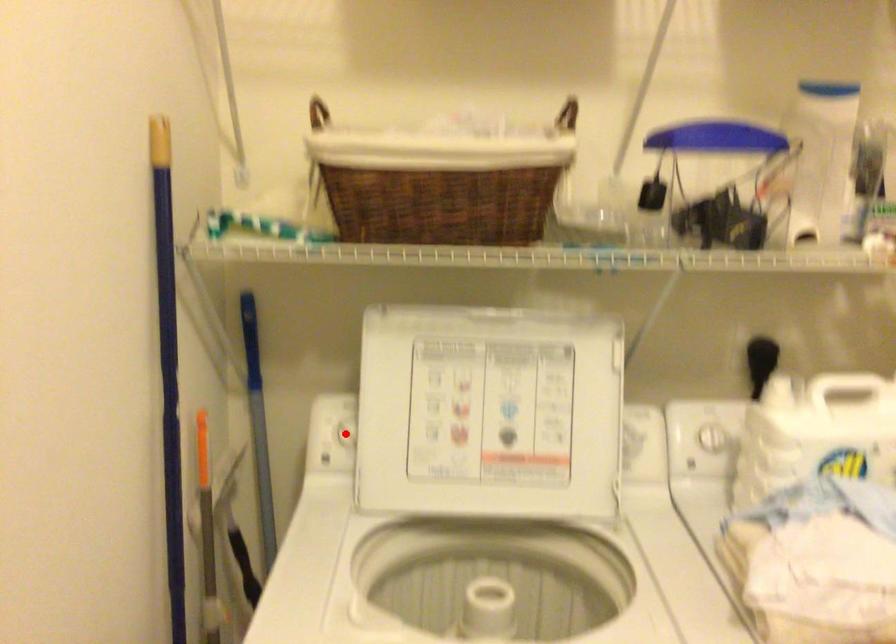
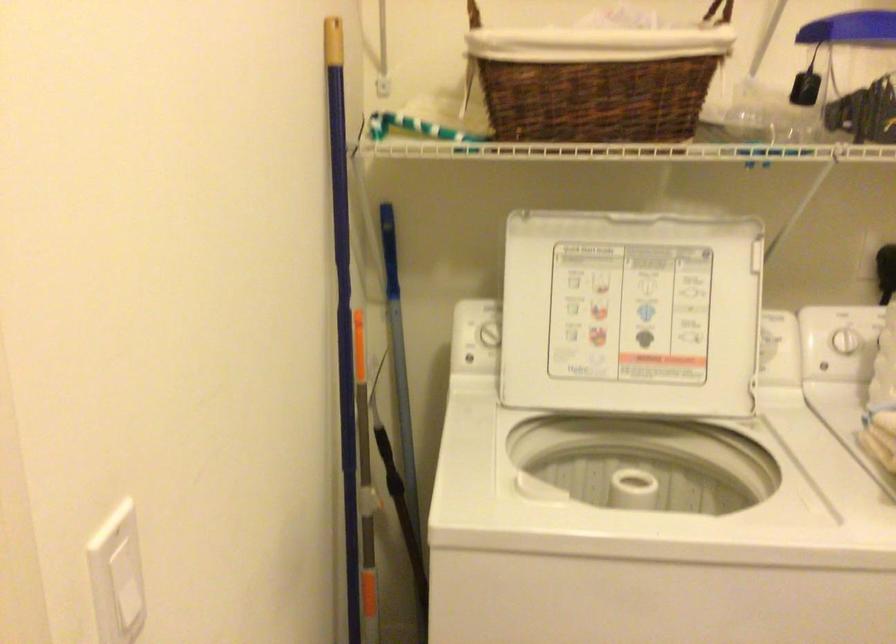
In the second image, find the point that corresponds to the highlighted location in the first image.

(488, 334)